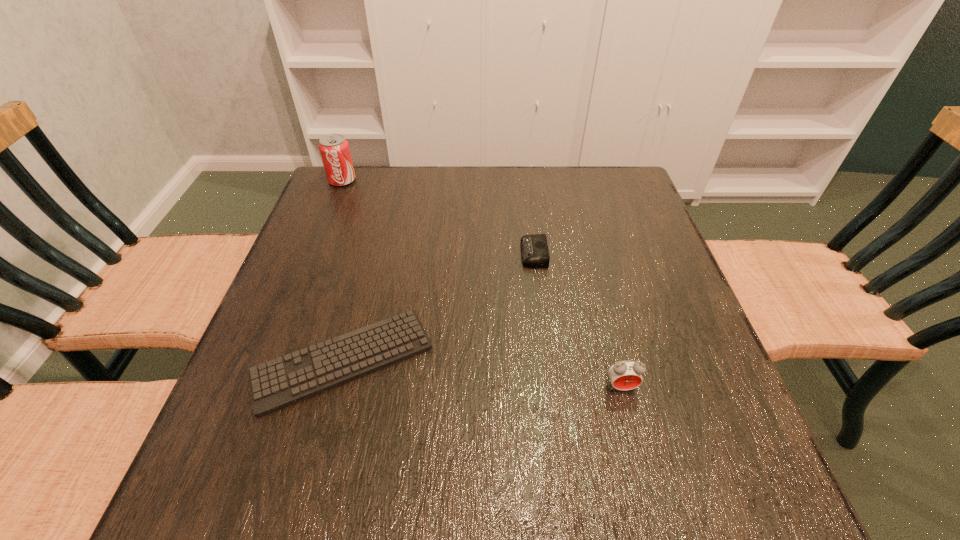
I want to click on blank region between the tallest object and the right alarm clock, so click(x=482, y=284).

At what (x,y) coordinates should I click in order to perform the action: click on free space that is in between the third object from left to right and the second tallest object. Please return your answer as a coordinate pair (x, y). Looking at the image, I should click on (578, 320).

Find the location of a particular element. This screenshot has height=540, width=960. vacant space in between the rightmost object and the soda can is located at coordinates [482, 284].

Identify the location of free space between the soda can and the third shortest object. This screenshot has width=960, height=540. (482, 284).

You are a GUI agent. You are given a task and a screenshot of the screen. Output one action in this format:
    pyautogui.click(x=<x>, y=<y>)
    Task: Click on the second closest object to the shortest object
    The height and width of the screenshot is (540, 960).
    Given the screenshot: What is the action you would take?
    pyautogui.click(x=625, y=375)

Find the location of a particular element. This screenshot has height=540, width=960. object that is the third closest to the shortest object is located at coordinates (334, 149).

The width and height of the screenshot is (960, 540). In order to click on vacant position in the image that satisfies the following two spatial constraints: 1. on the display of the shorter alarm clock; 2. on the front side of the computer keyboard in this screenshot , I will do `click(548, 360)`.

The width and height of the screenshot is (960, 540). Find the location of `free space that satisfies the following two spatial constraints: 1. on the front side of the shortest object; 2. on the right side of the tallest object`. free space that satisfies the following two spatial constraints: 1. on the front side of the shortest object; 2. on the right side of the tallest object is located at coordinates (270, 360).